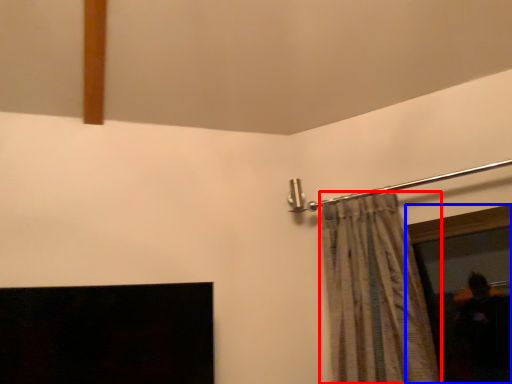
Question: Among these objects, which one is farthest to the camera, curtain (highlighted by a red box) or window screen (highlighted by a blue box)?

Choices:
 (A) curtain
 (B) window screen

Answer: (B)